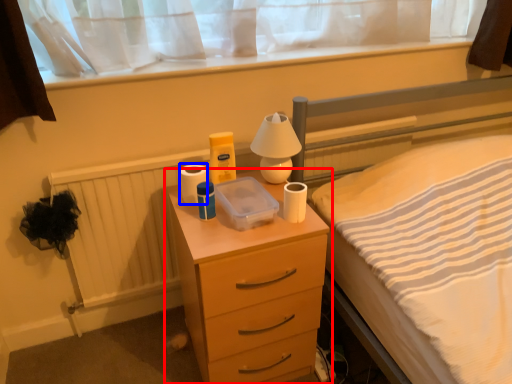
Question: Which object appears farthest to the camera in this image, chest of drawers (highlighted by a red box) or toilet paper (highlighted by a blue box)?

Choices:
 (A) chest of drawers
 (B) toilet paper

Answer: (B)